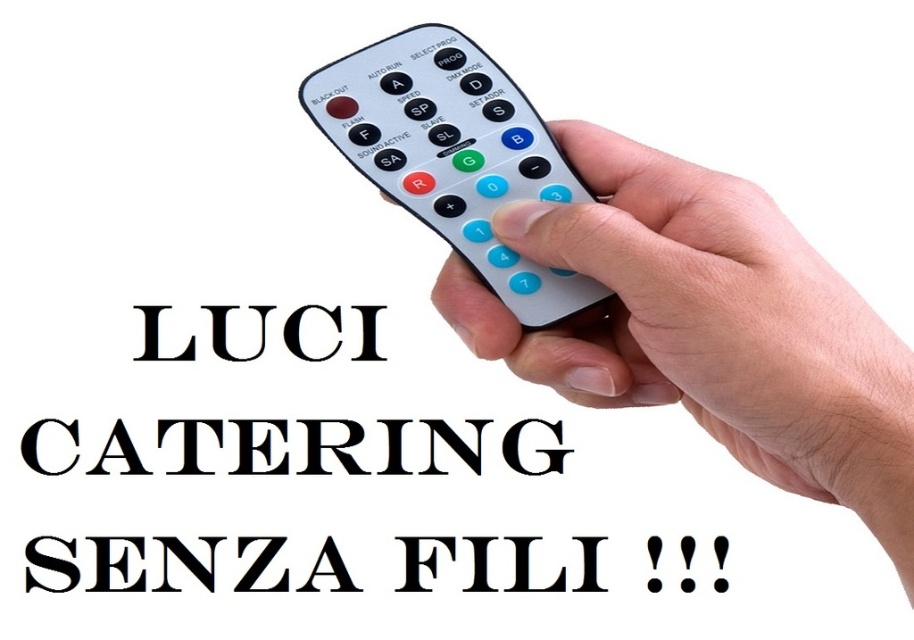
Is point (460, 144) behind point (354, 435)?

That is False.

Can you confirm if white plastic remote at center is bigger than black matte catering at center?

Correct, white plastic remote at center is larger in size than black matte catering at center.

The width and height of the screenshot is (914, 640). In order to click on white plastic remote at center in this screenshot , I will do point(453,154).

Who is shorter, white matte remote control at center or white plastic remote at center?

white plastic remote at center is shorter.

Describe the element at coordinates (707, 323) in the screenshot. This screenshot has height=640, width=914. I see `white matte remote control at center` at that location.

At what (x,y) coordinates should I click in order to perform the action: click on white matte remote control at center. Please return your answer as a coordinate pair (x, y). Looking at the image, I should click on (707, 323).

Between black matte catering at center and black solid text at center, which one is positioned lower?

black matte catering at center is below.

Is point (426, 468) in front of point (264, 310)?

No, it is not.

Does point (424, 464) come in front of point (186, 352)?

That is False.

Find the location of a particular element. The width and height of the screenshot is (914, 640). black matte catering at center is located at coordinates (293, 445).